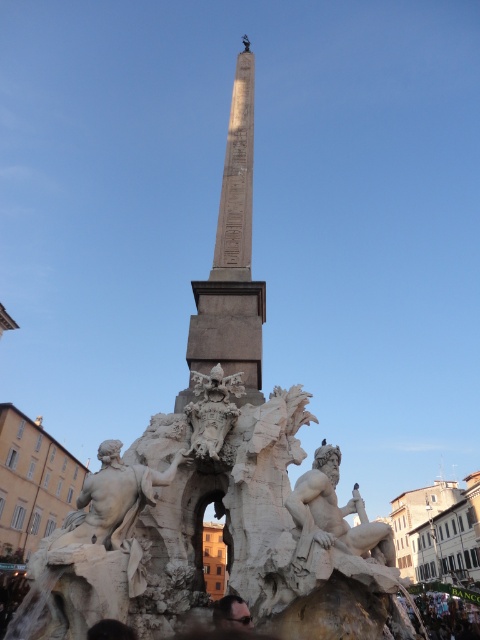
Question: Which is nearer to the smooth skin face at lower center?

Choices:
 (A) white marble statue at center
 (B) white stone sculpture at center
 (C) white stone figure at center

Answer: (C)

Question: Does white marble statue at center appear on the right side of white stone figure at center?

Choices:
 (A) no
 (B) yes

Answer: (A)

Question: Is white marble statue at center closer to camera compared to white stone figure at center?

Choices:
 (A) yes
 (B) no

Answer: (B)

Question: Which of the following is the farthest from the observer?

Choices:
 (A) white marble statue at center
 (B) white stone figure at center

Answer: (A)

Question: Is white stone obelisk at center in front of white stone sculpture at center?

Choices:
 (A) yes
 (B) no

Answer: (B)

Question: Estimate the real-world distances between objects in this image. Which object is closer to the white stone figure at center?

Choices:
 (A) smooth skin face at lower center
 (B) white stone obelisk at center
 (C) white stone sculpture at center

Answer: (C)